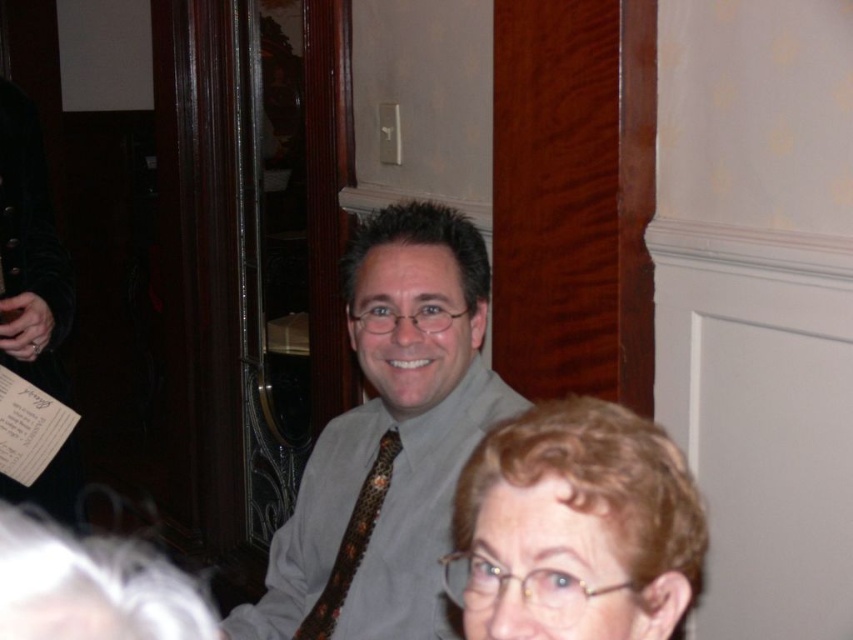
You are a photographer at this event and want to ensure both the matte gray shirt at center and the leopard print tie at center are clearly visible in your photo. Given their sizes, which one should you focus on first to ensure proper framing?

The matte gray shirt at center is much taller than the leopard print tie at center, so focusing on the matte gray shirt at center first will ensure proper framing as it occupies more space in the composition.

Consider the image. You are a photographer at the event and want to capture both the light brown hair at lower right and the leopard print tie at center in a single frame. Which object should you focus on first to ensure both are in the frame?

You should focus on the leopard print tie at center first since it is smaller than the light brown hair at lower right, allowing you to frame both by adjusting the camera to include the larger light brown hair at lower right.